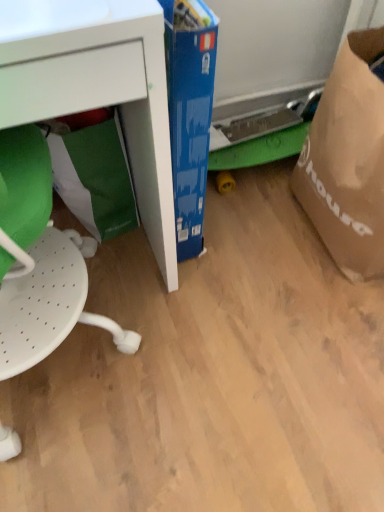
Question: Considering the relative sizes of brown paper grocery bag at right, which is counted as the first grocery bag, starting from the right, and white perforated swivel chair at left in the image provided, is brown paper grocery bag at right, which is counted as the first grocery bag, starting from the right, taller than white perforated swivel chair at left?

Choices:
 (A) yes
 (B) no

Answer: (B)

Question: Is brown paper grocery bag at right, which is counted as the first grocery bag, starting from the right, shorter than white perforated swivel chair at left?

Choices:
 (A) no
 (B) yes

Answer: (B)

Question: Is brown paper grocery bag at right, which is the 2th grocery bag in left-to-right order, next to white perforated swivel chair at left and touching it?

Choices:
 (A) yes
 (B) no

Answer: (B)

Question: Can you confirm if brown paper grocery bag at right, which is the 2th grocery bag in left-to-right order, is positioned to the right of white perforated swivel chair at left?

Choices:
 (A) yes
 (B) no

Answer: (A)

Question: Considering the relative sizes of brown paper grocery bag at right, which is the 2th grocery bag in left-to-right order, and white perforated swivel chair at left in the image provided, is brown paper grocery bag at right, which is the 2th grocery bag in left-to-right order, smaller than white perforated swivel chair at left?

Choices:
 (A) no
 (B) yes

Answer: (B)

Question: Is brown paper grocery bag at right, which is counted as the first grocery bag, starting from the right, wider or thinner than green paper bag at lower left, the second grocery bag from the right?

Choices:
 (A) wide
 (B) thin

Answer: (A)

Question: Do you think brown paper grocery bag at right, which is the 2th grocery bag in left-to-right order, is within green paper bag at lower left, which ranks as the 1th grocery bag in left-to-right order, or outside of it?

Choices:
 (A) inside
 (B) outside

Answer: (B)

Question: In terms of height, does brown paper grocery bag at right, which is the 2th grocery bag in left-to-right order, look taller or shorter compared to green paper bag at lower left, which ranks as the 1th grocery bag in left-to-right order?

Choices:
 (A) tall
 (B) short

Answer: (A)

Question: Based on their sizes in the image, would you say brown paper grocery bag at right, which is counted as the first grocery bag, starting from the right, is bigger or smaller than green paper bag at lower left, which ranks as the 1th grocery bag in left-to-right order?

Choices:
 (A) big
 (B) small

Answer: (A)

Question: Considering the positions of green paper bag at lower left, the second grocery bag from the right, and white matte desk at lower left in the image, is green paper bag at lower left, the second grocery bag from the right, taller or shorter than white matte desk at lower left?

Choices:
 (A) tall
 (B) short

Answer: (B)

Question: From the image's perspective, is green paper bag at lower left, which ranks as the 1th grocery bag in left-to-right order, positioned above or below white matte desk at lower left?

Choices:
 (A) above
 (B) below

Answer: (B)

Question: Would you say green paper bag at lower left, the second grocery bag from the right, is inside or outside white matte desk at lower left?

Choices:
 (A) outside
 (B) inside

Answer: (B)

Question: From a real-world perspective, is green paper bag at lower left, which ranks as the 1th grocery bag in left-to-right order, physically located above or below white matte desk at lower left?

Choices:
 (A) below
 (B) above

Answer: (A)

Question: Considering the positions of white matte desk at lower left and brown paper grocery bag at right, which is counted as the first grocery bag, starting from the right, in the image, is white matte desk at lower left taller or shorter than brown paper grocery bag at right, which is counted as the first grocery bag, starting from the right,?

Choices:
 (A) tall
 (B) short

Answer: (A)

Question: Visually, is white matte desk at lower left positioned to the left or to the right of brown paper grocery bag at right, which is the 2th grocery bag in left-to-right order?

Choices:
 (A) right
 (B) left

Answer: (B)